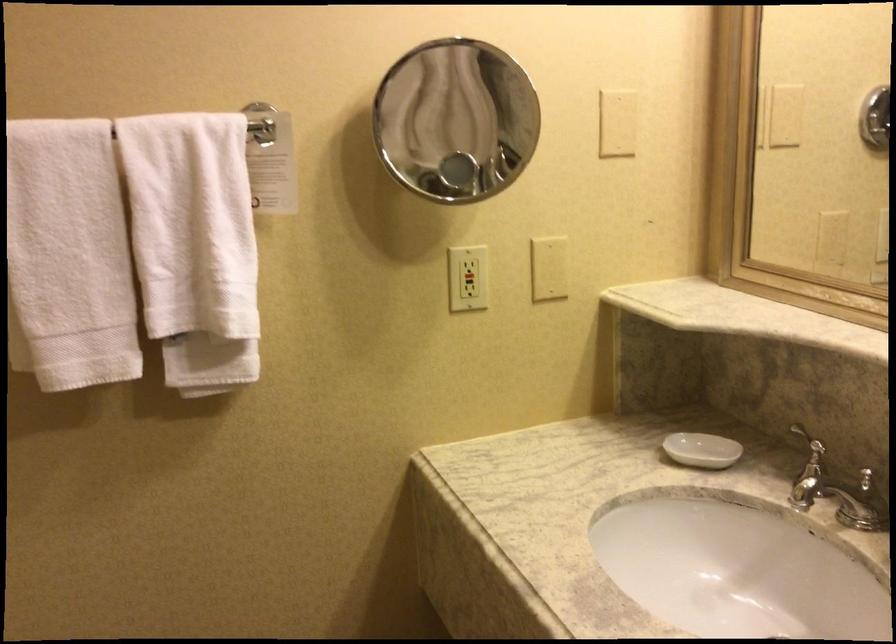
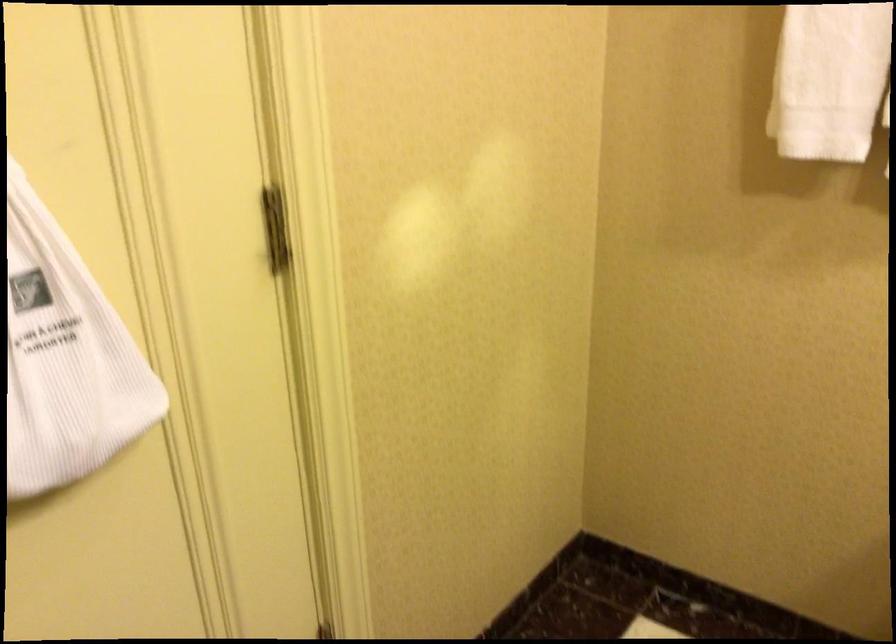
In the second image, find the point that corresponds to point 76,305 in the first image.

(830, 80)